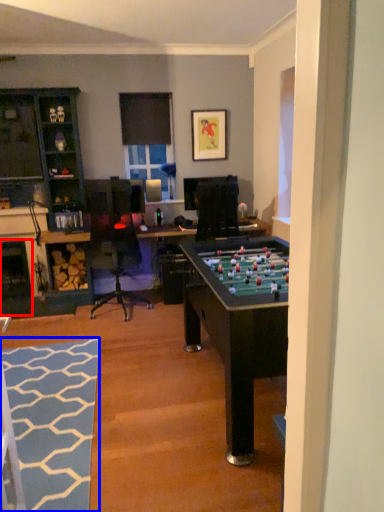
Question: Among these objects, which one is nearest to the camera, fireplace (highlighted by a red box) or flat (highlighted by a blue box)?

Choices:
 (A) fireplace
 (B) flat

Answer: (B)